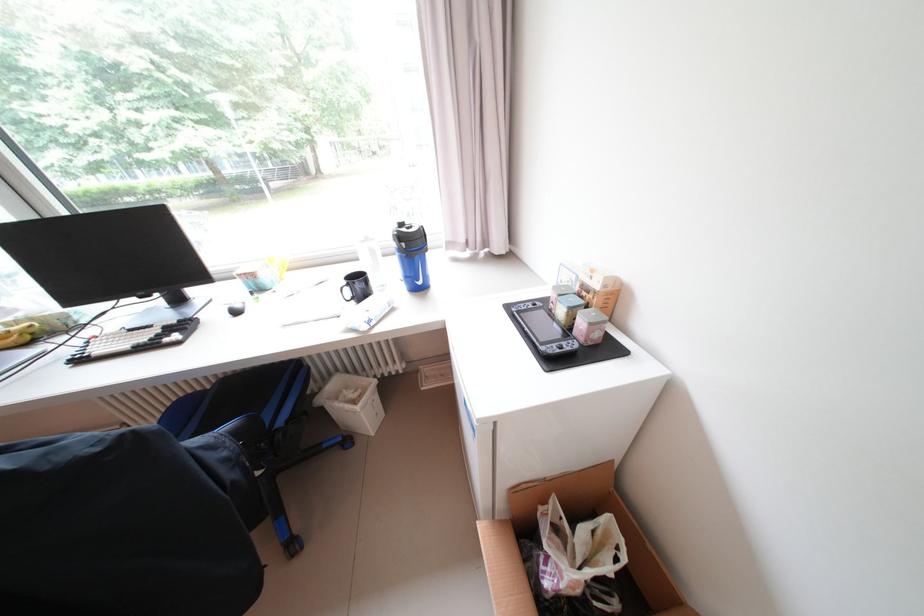
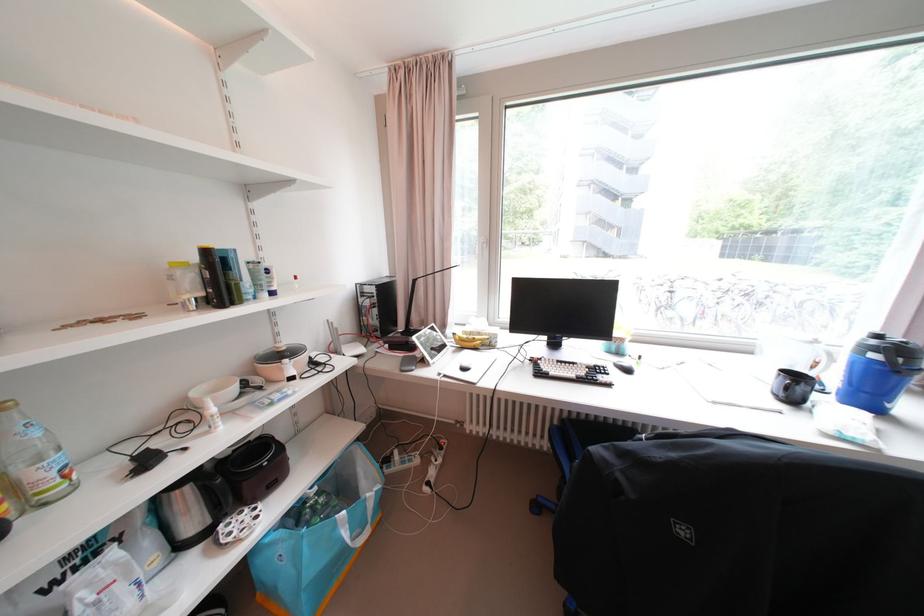
Where in the second image is the point corresponding to (411,246) from the first image?

(909, 361)